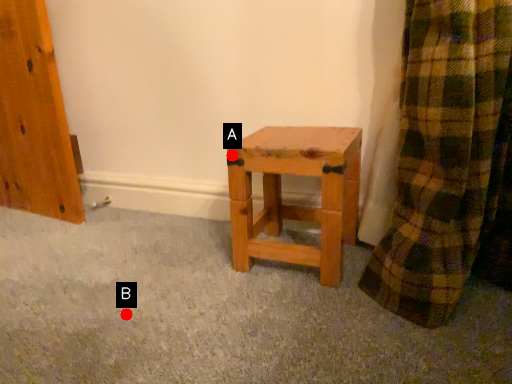
Question: Two points are circled on the image, labeled by A and B beside each circle. Which point appears farthest from the camera in this image?

Choices:
 (A) A is further
 (B) B is further

Answer: (A)